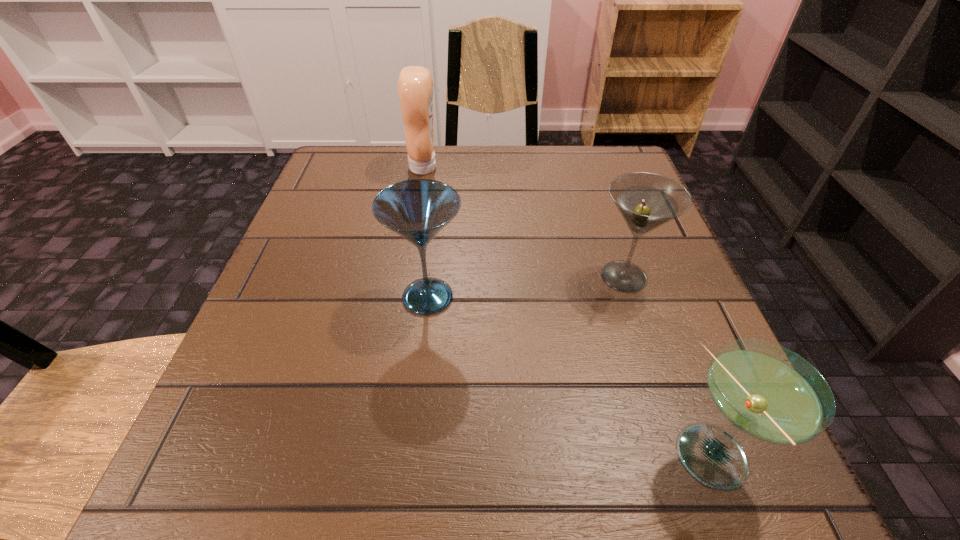
This screenshot has height=540, width=960. Find the location of `the farthest object`. the farthest object is located at coordinates (415, 84).

Where is `the leftmost martini`? the leftmost martini is located at coordinates (418, 209).

Identify the location of the nearest object. (770, 393).

The height and width of the screenshot is (540, 960). What are the coordinates of `vacant space positioned 0.320m on the label of the farthest object` in the screenshot? It's located at (573, 167).

The height and width of the screenshot is (540, 960). Identify the location of free location located on the back of the leftmost martini. (443, 164).

Identify the location of vacant region located on the left of the nearest martini. (422, 458).

Identify the location of object that is at the far edge. (415, 84).

Where is `object at the near edge`? object at the near edge is located at coordinates (770, 393).

Locate an element on the screen. This screenshot has width=960, height=540. object that is positioned at the near right corner is located at coordinates 770,393.

I want to click on vacant space at the far edge of the desktop, so click(x=470, y=150).